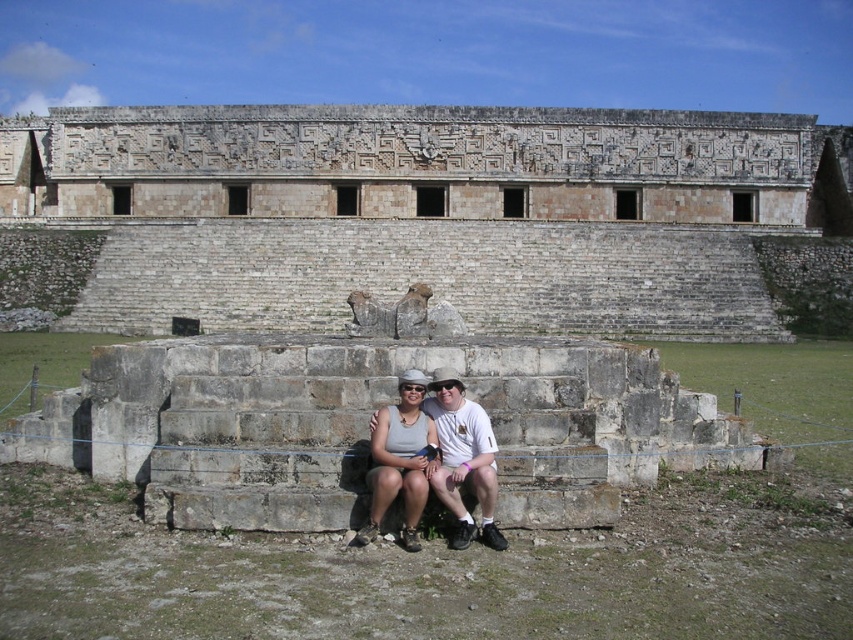
Is point (434, 241) positioned in front of point (428, 408)?

No, it is not.

Is point (218, 161) less distant than point (448, 442)?

No, (218, 161) is behind (448, 442).

You are a GUI agent. You are given a task and a screenshot of the screen. Output one action in this format:
    pyautogui.click(x=<x>, y=<y>)
    Task: Click on the stone amphitheater at center
    Image resolution: width=853 pixels, height=640 pixels.
    Given the screenshot: What is the action you would take?
    pyautogui.click(x=422, y=214)